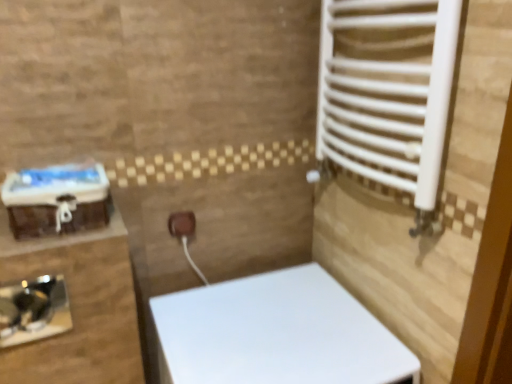
Question: From a real-world perspective, is white glossy toilet at center positioned under brown matte electric outlet at center based on gravity?

Choices:
 (A) yes
 (B) no

Answer: (A)

Question: Is white glossy toilet at center next to brown matte electric outlet at center and touching it?

Choices:
 (A) yes
 (B) no

Answer: (B)

Question: Considering the relative sizes of white glossy toilet at center and brown matte electric outlet at center in the image provided, is white glossy toilet at center thinner than brown matte electric outlet at center?

Choices:
 (A) no
 (B) yes

Answer: (A)

Question: Can you confirm if white glossy toilet at center is taller than brown matte electric outlet at center?

Choices:
 (A) yes
 (B) no

Answer: (A)

Question: Can you confirm if white glossy toilet at center is smaller than brown matte electric outlet at center?

Choices:
 (A) yes
 (B) no

Answer: (B)

Question: Is white glossy toilet at center completely or partially outside of brown matte electric outlet at center?

Choices:
 (A) yes
 (B) no

Answer: (A)

Question: From a real-world perspective, does brown matte electric outlet at center stand above white glossy toilet at center?

Choices:
 (A) yes
 (B) no

Answer: (A)

Question: Is brown matte electric outlet at center in front of white glossy toilet at center?

Choices:
 (A) no
 (B) yes

Answer: (A)

Question: Is brown matte electric outlet at center at the right side of white glossy toilet at center?

Choices:
 (A) yes
 (B) no

Answer: (B)

Question: Is brown matte electric outlet at center not inside white glossy toilet at center?

Choices:
 (A) no
 (B) yes

Answer: (B)

Question: From the image's perspective, is brown matte electric outlet at center located beneath white glossy toilet at center?

Choices:
 (A) yes
 (B) no

Answer: (B)

Question: Is brown matte electric outlet at center shorter than white glossy toilet at center?

Choices:
 (A) no
 (B) yes

Answer: (B)

Question: Is brown matte electric outlet at center far away from black glossy sink at lower left?

Choices:
 (A) yes
 (B) no

Answer: (B)